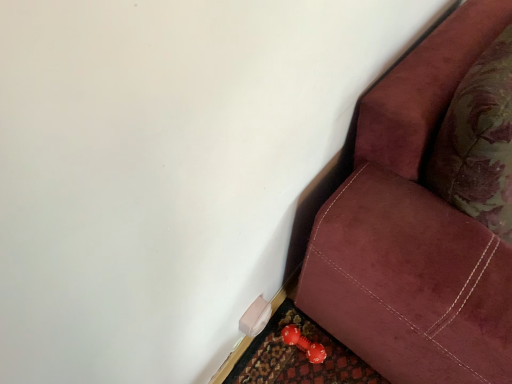
The width and height of the screenshot is (512, 384). Describe the element at coordinates (413, 232) in the screenshot. I see `suede-like burgundy couch at lower right` at that location.

Find the location of a particular element. suede-like burgundy couch at lower right is located at coordinates (413, 232).

Find the location of a particular element. The image size is (512, 384). suede-like burgundy couch at lower right is located at coordinates (413, 232).